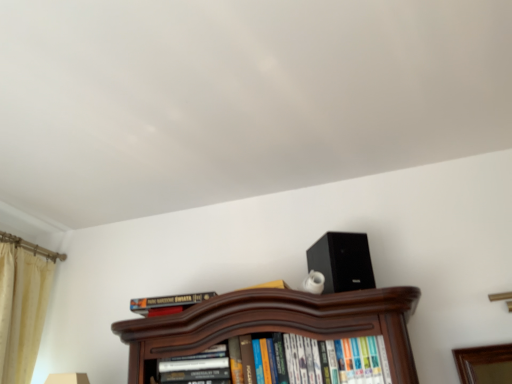
Question: Should I look upward or downward to see black matte speaker at upper right?

Choices:
 (A) up
 (B) down

Answer: (B)

Question: Does hardcover book at center, which ranks as the 2th book in right-to-left order, appear on the left side of hardcover books at center, which ranks as the third book in left-to-right order?

Choices:
 (A) yes
 (B) no

Answer: (A)

Question: Does hardcover book at center, which ranks as the 2th book in right-to-left order, have a lesser width compared to hardcover books at center, the 1th book from the right?

Choices:
 (A) no
 (B) yes

Answer: (B)

Question: Is hardcover book at center, positioned as the 2th book in left-to-right order, smaller than hardcover books at center, which ranks as the third book in left-to-right order?

Choices:
 (A) yes
 (B) no

Answer: (A)

Question: Is hardcover book at center, which ranks as the 2th book in right-to-left order, wider than hardcover books at center, the 1th book from the right?

Choices:
 (A) no
 (B) yes

Answer: (A)

Question: Is hardcover book at center, which ranks as the 2th book in right-to-left order, looking in the opposite direction of hardcover books at center, which ranks as the third book in left-to-right order?

Choices:
 (A) no
 (B) yes

Answer: (A)

Question: Is hardcover book at center, which ranks as the 2th book in right-to-left order, directly adjacent to hardcover books at center, which ranks as the third book in left-to-right order?

Choices:
 (A) no
 (B) yes

Answer: (A)

Question: Considering the relative sizes of hardcover books at center, which ranks as the third book in left-to-right order, and black matte speaker at upper right in the image provided, is hardcover books at center, which ranks as the third book in left-to-right order, taller than black matte speaker at upper right?

Choices:
 (A) no
 (B) yes

Answer: (B)

Question: Considering the relative sizes of hardcover books at center, which ranks as the third book in left-to-right order, and black matte speaker at upper right in the image provided, is hardcover books at center, which ranks as the third book in left-to-right order, wider than black matte speaker at upper right?

Choices:
 (A) yes
 (B) no

Answer: (A)

Question: From the image's perspective, does hardcover books at center, the 1th book from the right, appear lower than black matte speaker at upper right?

Choices:
 (A) no
 (B) yes

Answer: (B)

Question: Can you confirm if hardcover books at center, the 1th book from the right, is thinner than black matte speaker at upper right?

Choices:
 (A) no
 (B) yes

Answer: (A)

Question: Are hardcover books at center, which ranks as the third book in left-to-right order, and black matte speaker at upper right far apart?

Choices:
 (A) no
 (B) yes

Answer: (A)

Question: Is hardcover books at center, which ranks as the third book in left-to-right order, positioned behind black matte speaker at upper right?

Choices:
 (A) yes
 (B) no

Answer: (B)

Question: Is beige velvet curtain at left thinner than black matte speaker at upper right?

Choices:
 (A) yes
 (B) no

Answer: (A)